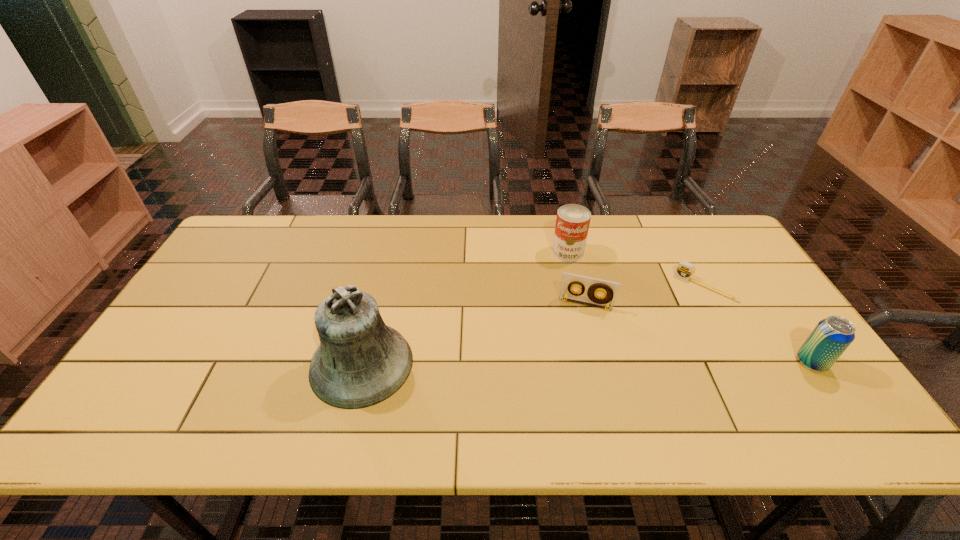
This screenshot has height=540, width=960. What are the coordinates of `beer can at the near edge` in the screenshot? It's located at (832, 336).

This screenshot has height=540, width=960. Find the location of `beer can that is at the right edge`. beer can that is at the right edge is located at coordinates (832, 336).

I want to click on tape measure that is at the right edge, so click(x=685, y=270).

You are a GUI agent. You are given a task and a screenshot of the screen. Output one action in this format:
    pyautogui.click(x=<x>, y=<y>)
    Task: Click on the object at the near right corner
    
    Given the screenshot: What is the action you would take?
    [832, 336]

Locate an element on the screen. Image resolution: width=960 pixels, height=540 pixels. free space at the far edge of the desktop is located at coordinates (411, 238).

This screenshot has width=960, height=540. In order to click on vacant area at the near edge in this screenshot , I will do `click(742, 387)`.

The image size is (960, 540). Identify the location of vacant space at the left edge of the desktop. 213,297.

Find the location of `free space between the can and the bell`. free space between the can and the bell is located at coordinates (465, 308).

Identify the location of free space between the videotape and the tape measure. (646, 295).

Image resolution: width=960 pixels, height=540 pixels. What are the coordinates of `free spot between the tape measure and the farthest object` in the screenshot? It's located at (636, 269).